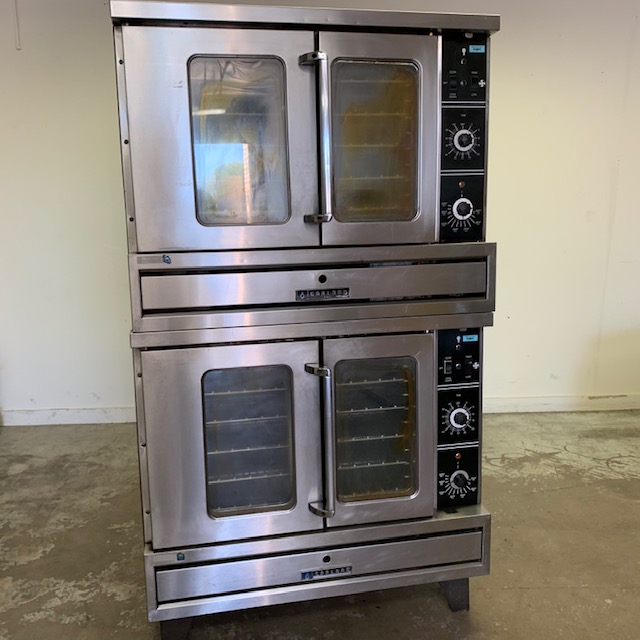
Find the location of a particular element. oven feet is located at coordinates (457, 598), (173, 626).